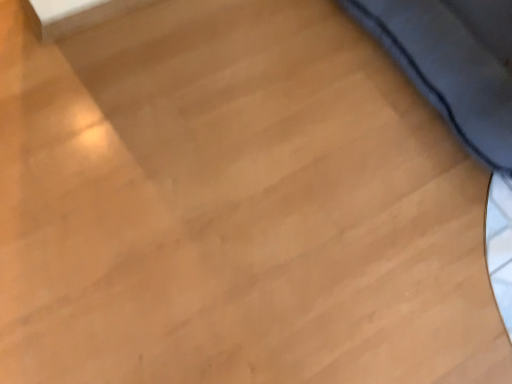
Find the location of `dark blue fabric sleeping bag at upper right`. dark blue fabric sleeping bag at upper right is located at coordinates (450, 66).

The width and height of the screenshot is (512, 384). What do you see at coordinates (450, 66) in the screenshot?
I see `dark blue fabric sleeping bag at upper right` at bounding box center [450, 66].

You are a GUI agent. You are given a task and a screenshot of the screen. Output one action in this format:
    pyautogui.click(x=<x>, y=<y>)
    Task: Click on the dark blue fabric sleeping bag at upper right
    Image resolution: width=512 pixels, height=384 pixels.
    Given the screenshot: What is the action you would take?
    pyautogui.click(x=450, y=66)